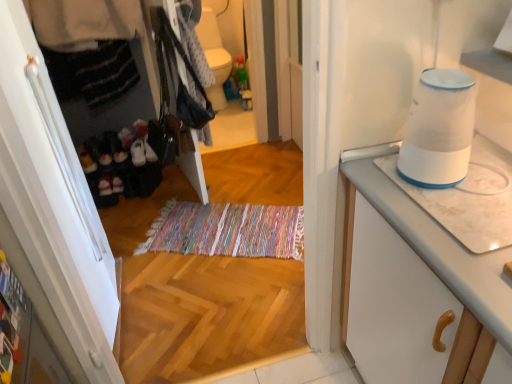
At what (x,y) coordinates should I click in order to perform the action: click on vacant area that is situated to the right of white matte cabinet at left. Please return your answer as a coordinate pair (x, y). Looking at the image, I should click on (192, 293).